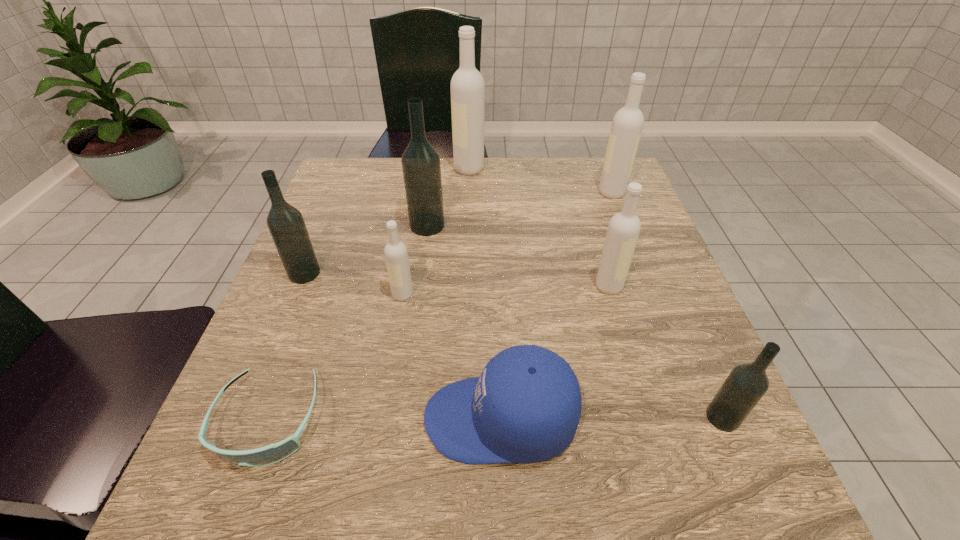
Where is `the leftmost white vodka`? This screenshot has width=960, height=540. the leftmost white vodka is located at coordinates (396, 255).

The width and height of the screenshot is (960, 540). Identify the location of the nearest black vodka. (746, 384).

Identify the location of the rightmost black vodka. The height and width of the screenshot is (540, 960). pyautogui.click(x=746, y=384).

In order to click on cap in this screenshot , I will do `click(525, 407)`.

Locate an element on the screen. blue cap is located at coordinates (525, 407).

Identify the location of the shortest object. This screenshot has height=540, width=960. (273, 453).

At what (x,y) coordinates should I click in order to perform the action: click on vacant space positioned 0.240m on the front of the tallest vodka. Please return your answer as a coordinate pair (x, y). The width and height of the screenshot is (960, 540). Looking at the image, I should click on (467, 232).

Identify the location of free space located on the left of the second farthest white vodka. This screenshot has height=540, width=960. (494, 192).

The width and height of the screenshot is (960, 540). Identify the location of vacant space located on the front of the second black vodka from left to right. (423, 256).

You are a GUI agent. You are given a task and a screenshot of the screen. Output one action in this format:
    pyautogui.click(x=<x>, y=<y>)
    Task: Click on the vacant space located on the left of the third white vodka from left to right
    
    Given the screenshot: What is the action you would take?
    pyautogui.click(x=526, y=286)